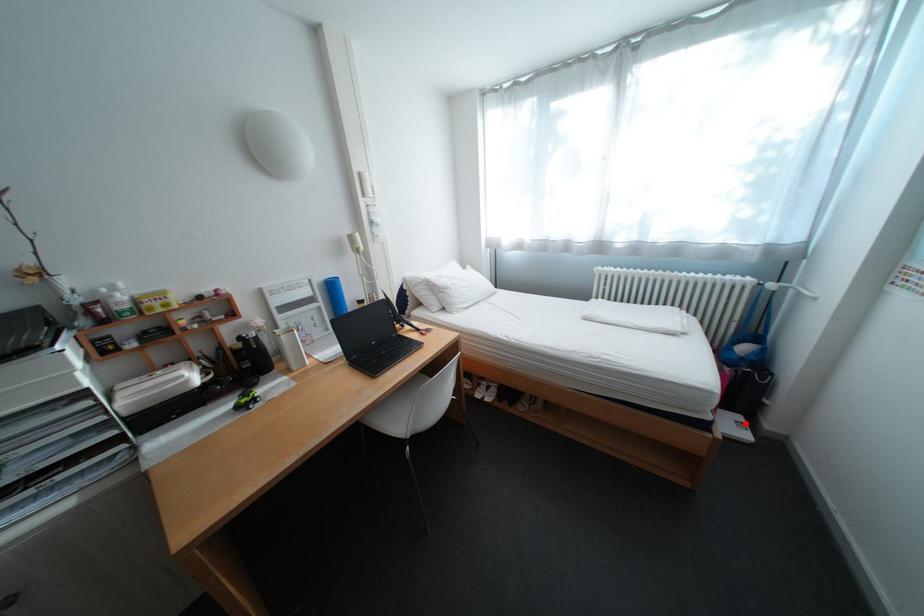
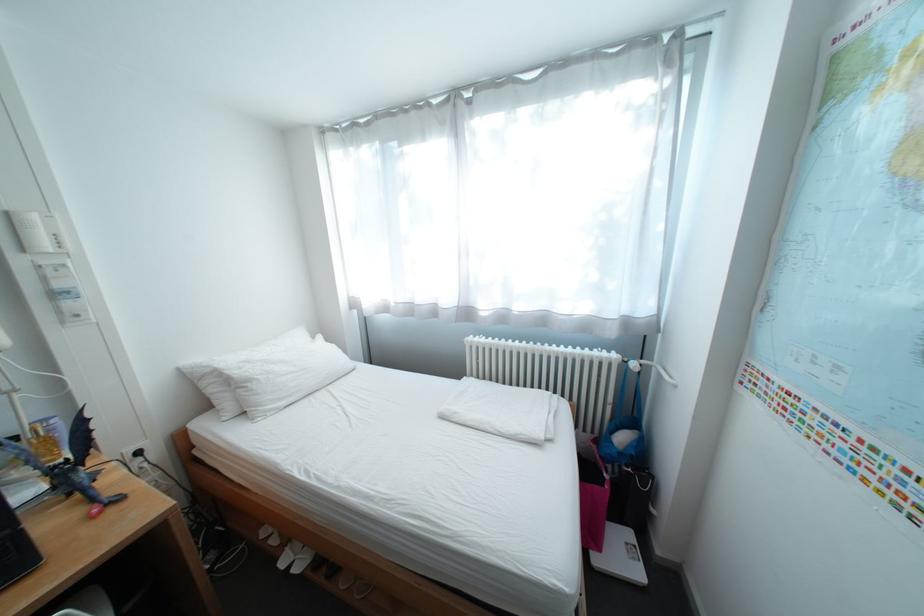
Question: I am providing you with two images of the same scene from different viewpoints. Given a red point in image1, look at the same physical point in image2. Is it:

Choices:
 (A) Closer to the viewpoint
 (B) Farther from the viewpoint

Answer: (A)